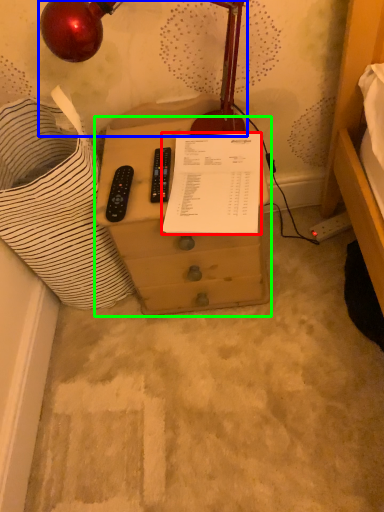
Question: Estimate the real-world distances between objects in this image. Which object is farther from document (highlighted by a red box), lamp (highlighted by a blue box) or furniture (highlighted by a green box)?

Choices:
 (A) lamp
 (B) furniture

Answer: (A)